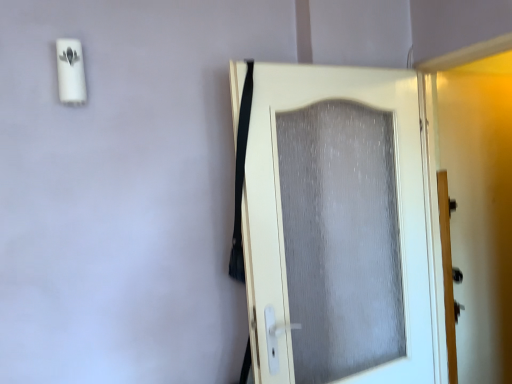
Identify the location of white textured door at center. (339, 225).

The height and width of the screenshot is (384, 512). What do you see at coordinates (339, 225) in the screenshot?
I see `white textured door at center` at bounding box center [339, 225].

In order to face white textured door at center, should I rotate leftwards or rightwards?

Turn right approximately 12.633 degrees to face it.

Where is `matte gray screen door at right`? Image resolution: width=512 pixels, height=384 pixels. matte gray screen door at right is located at coordinates (x=480, y=208).

The image size is (512, 384). What do you see at coordinates (480, 208) in the screenshot?
I see `matte gray screen door at right` at bounding box center [480, 208].

The height and width of the screenshot is (384, 512). I want to click on white textured door at center, so click(339, 225).

Which is more to the right, matte gray screen door at right or white textured door at center?

matte gray screen door at right.

Does matte gray screen door at right lie behind white textured door at center?

Yes, the depth of matte gray screen door at right is greater than that of white textured door at center.

Which is nearer, (508, 329) or (367, 276)?

Point (508, 329) appears to be farther away from the viewer than point (367, 276).

From the image's perspective, who appears lower, matte gray screen door at right or white textured door at center?

white textured door at center.

From a real-world perspective, is matte gray screen door at right above or below white textured door at center?

matte gray screen door at right is above white textured door at center.

Can you confirm if matte gray screen door at right is wider than white textured door at center?

Correct, the width of matte gray screen door at right exceeds that of white textured door at center.

Is matte gray screen door at right shorter than white textured door at center?

In fact, matte gray screen door at right may be taller than white textured door at center.

Can you confirm if matte gray screen door at right is smaller than white textured door at center?

Indeed, matte gray screen door at right has a smaller size compared to white textured door at center.

Which is correct: matte gray screen door at right is inside white textured door at center, or outside of it?

matte gray screen door at right is located beyond the bounds of white textured door at center.

Is there a large distance between matte gray screen door at right and white textured door at center?

No, matte gray screen door at right is in close proximity to white textured door at center.

Looking at this image, is matte gray screen door at right positioned with its back to white textured door at center?

matte gray screen door at right is not turned away from white textured door at center.

What's the angular difference between matte gray screen door at right and white textured door at center's facing directions?

The angle between the facing direction of matte gray screen door at right and the facing direction of white textured door at center is 93.7 degrees.

Measure the distance between matte gray screen door at right and white textured door at center.

matte gray screen door at right is 21.85 inches away from white textured door at center.

You are a GUI agent. You are given a task and a screenshot of the screen. Output one action in this format:
    pyautogui.click(x=<x>, y=<y>)
    Task: Click on the door below the matte gray screen door at right (from the image's perspective)
    This screenshot has width=512, height=384.
    Given the screenshot: What is the action you would take?
    pyautogui.click(x=339, y=225)

Which is more to the right, white textured door at center or matte gray screen door at right?

matte gray screen door at right is more to the right.

Considering their positions, is white textured door at center located in front of or behind matte gray screen door at right?

Visually, white textured door at center is located in front of matte gray screen door at right.

Is point (411, 201) closer or farther from the camera than point (450, 156)?

Point (411, 201) is positioned closer to the camera compared to point (450, 156).

From the image's perspective, is white textured door at center located above matte gray screen door at right?

No.

From a real-world perspective, between white textured door at center and matte gray screen door at right, who is vertically lower?

From a 3D spatial view, white textured door at center is below.

Considering the sizes of objects white textured door at center and matte gray screen door at right in the image provided, who is wider, white textured door at center or matte gray screen door at right?

matte gray screen door at right is wider.

Who is shorter, white textured door at center or matte gray screen door at right?

white textured door at center is shorter.

Which of these two, white textured door at center or matte gray screen door at right, is smaller?

matte gray screen door at right.

Is matte gray screen door at right completely or partially inside white textured door at center?

No.

Are white textured door at center and matte gray screen door at right located far from each other?

white textured door at center is actually quite close to matte gray screen door at right.

Is white textured door at center oriented towards matte gray screen door at right?

Yes, white textured door at center faces towards matte gray screen door at right.

Can you tell me how much white textured door at center and matte gray screen door at right differ in facing direction?

The angular difference between white textured door at center and matte gray screen door at right is 93.7 degrees.

What are the coordinates of `screen door that appears above the white textured door at center (from a real-world perspective)` in the screenshot? It's located at (480, 208).

I want to click on screen door above the white textured door at center (from a real-world perspective), so click(x=480, y=208).

Image resolution: width=512 pixels, height=384 pixels. In order to click on door below the matte gray screen door at right (from the image's perspective) in this screenshot , I will do coord(339,225).